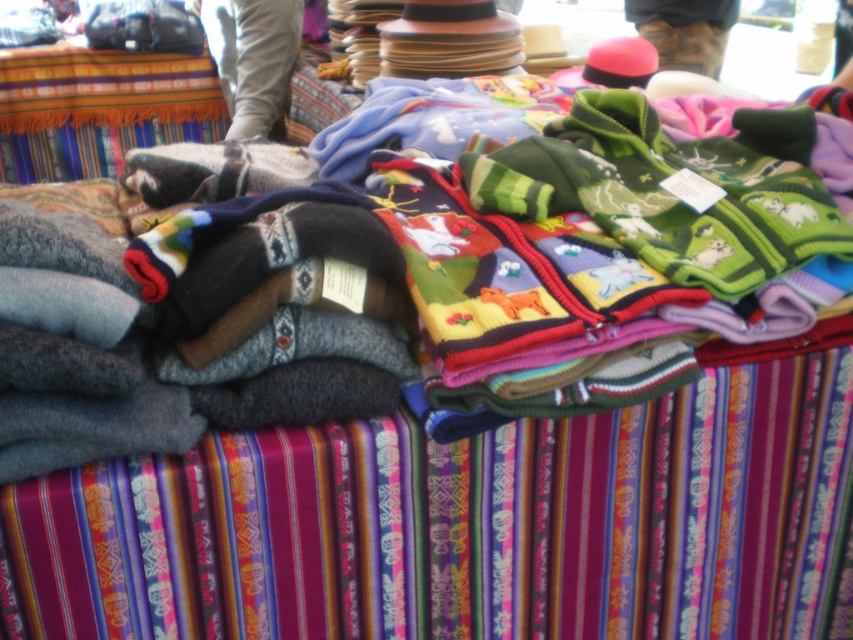
The width and height of the screenshot is (853, 640). What do you see at coordinates (252, 58) in the screenshot?
I see `knitted wool sweater at upper center` at bounding box center [252, 58].

Is knitted wool sweater at upper center positioned behind camouflage-patterned pants at upper center?

Yes, it is.

This screenshot has width=853, height=640. In order to click on knitted wool sweater at upper center in this screenshot , I will do `click(252, 58)`.